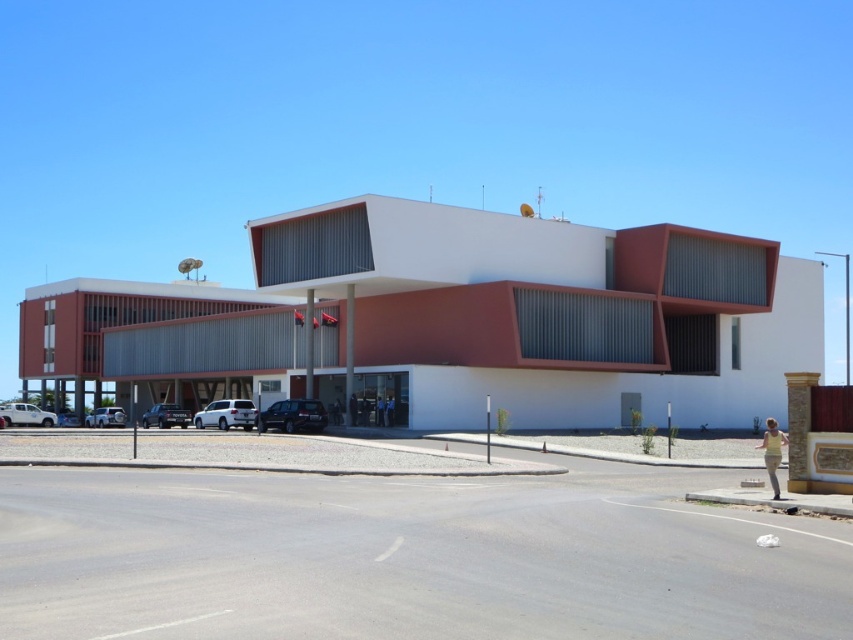
Between point (192, 419) and point (18, 410), which one is positioned behind?

Positioned behind is point (18, 410).

I want to click on satin silver suv at center, so click(x=225, y=413).

Can you confirm if metallic silver car at lower left is positioned to the left of blue uniformed man at center?

Correct, you'll find metallic silver car at lower left to the left of blue uniformed man at center.

Is metallic silver car at lower left wider than blue uniformed man at center?

Yes, metallic silver car at lower left is wider than blue uniformed man at center.

Locate an element on the screen. metallic silver car at lower left is located at coordinates (105, 417).

Locate an element on the screen. Image resolution: width=853 pixels, height=640 pixels. metallic silver car at lower left is located at coordinates (105, 417).

Which is in front, point (183, 419) or point (390, 394)?

Point (390, 394) is more forward.

Can you confirm if satin black car at lower left is positioned to the left of blue uniformed man at center?

Yes, satin black car at lower left is to the left of blue uniformed man at center.

Is point (146, 412) positioned after point (393, 412)?

That is True.

Where is `satin black car at lower left`? This screenshot has height=640, width=853. satin black car at lower left is located at coordinates (165, 416).